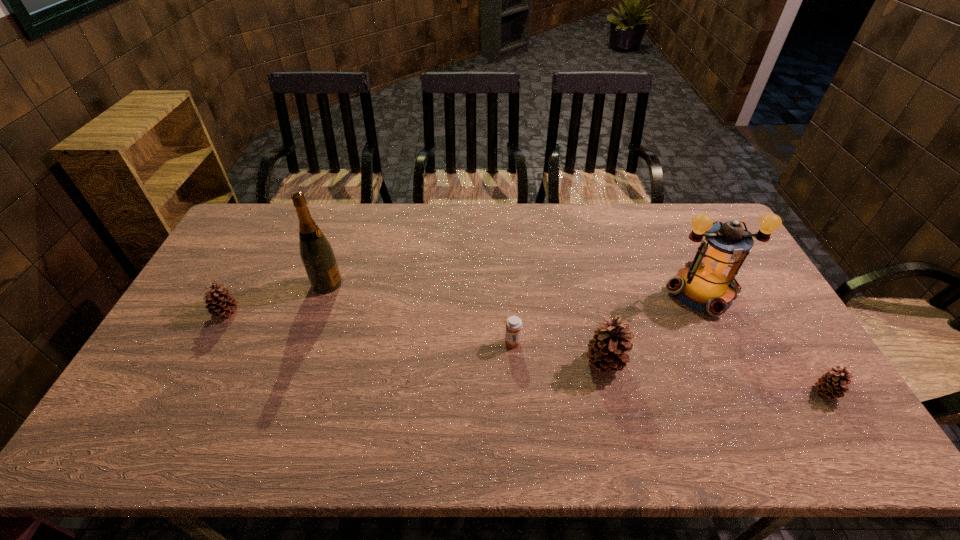
You are a GUI agent. You are given a task and a screenshot of the screen. Output one action in this format:
    pyautogui.click(x=<x>, y=<y>)
    Task: Click on the spot to insert another pinecone for uniform distribution
    This screenshot has height=540, width=960.
    Given the screenshot: What is the action you would take?
    pyautogui.click(x=406, y=337)